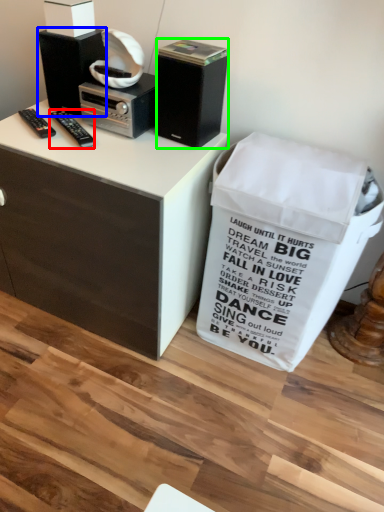
Question: Which object is positioned farthest from remote control (highlighted by a red box)? Select from loudspeaker (highlighted by a blue box) and loudspeaker (highlighted by a green box).

Choices:
 (A) loudspeaker
 (B) loudspeaker

Answer: (B)